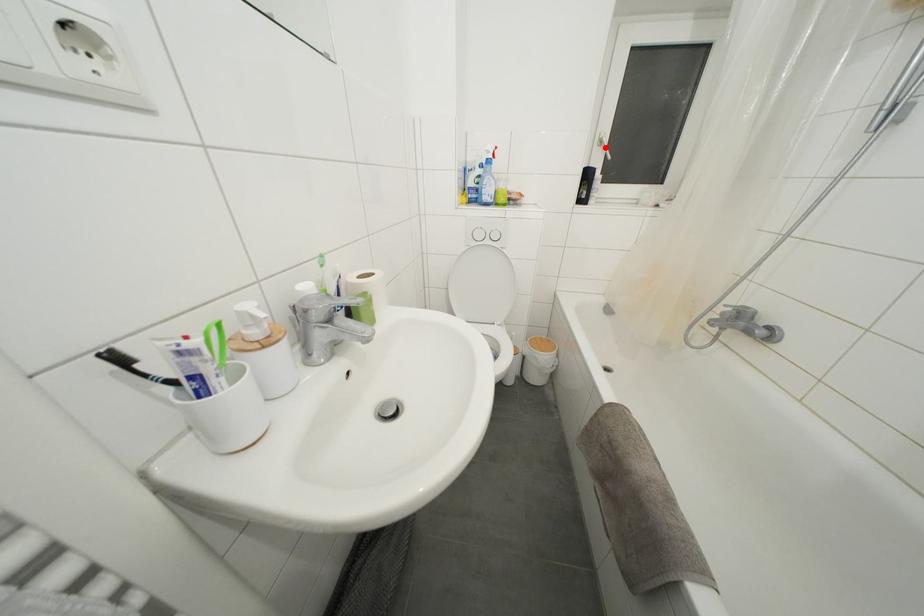
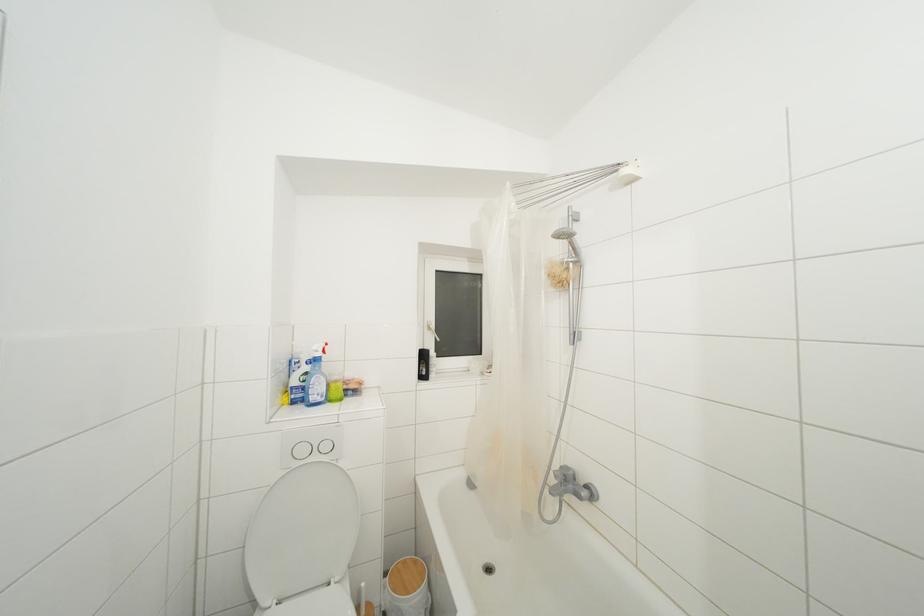
Question: I am providing you with two images of the same scene from different viewpoints. Given a red point in image1, look at the same physical point in image2. Is it:

Choices:
 (A) Closer to the viewpoint
 (B) Farther from the viewpoint

Answer: (B)